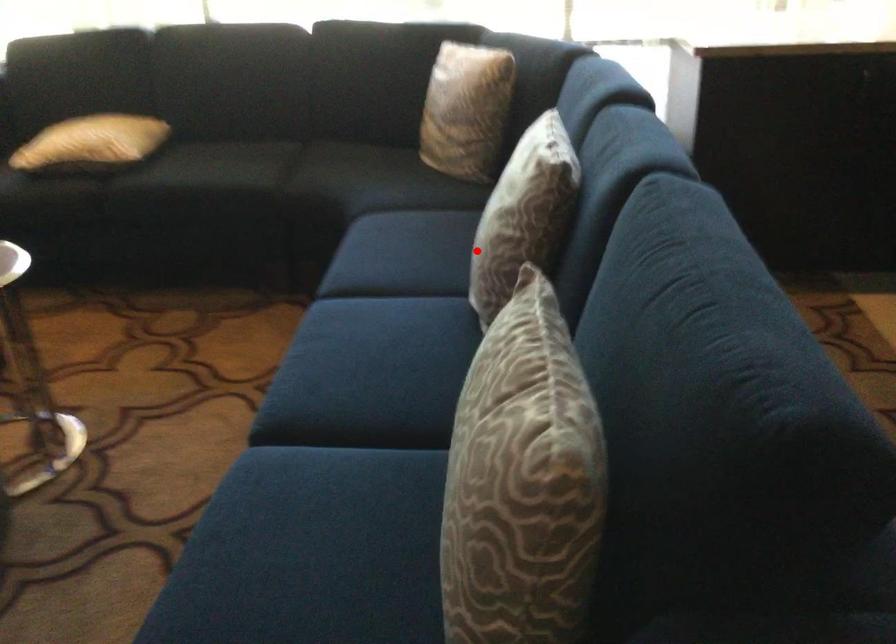
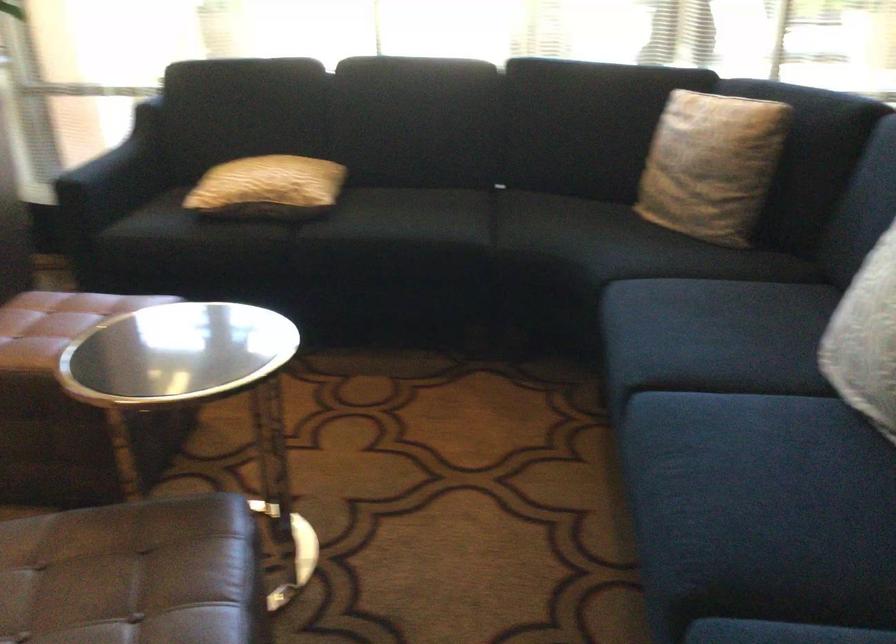
Question: I am providing you with two images of the same scene from different viewpoints. Given a red point in image1, look at the same physical point in image2. Is it:

Choices:
 (A) Closer to the viewpoint
 (B) Farther from the viewpoint

Answer: (A)